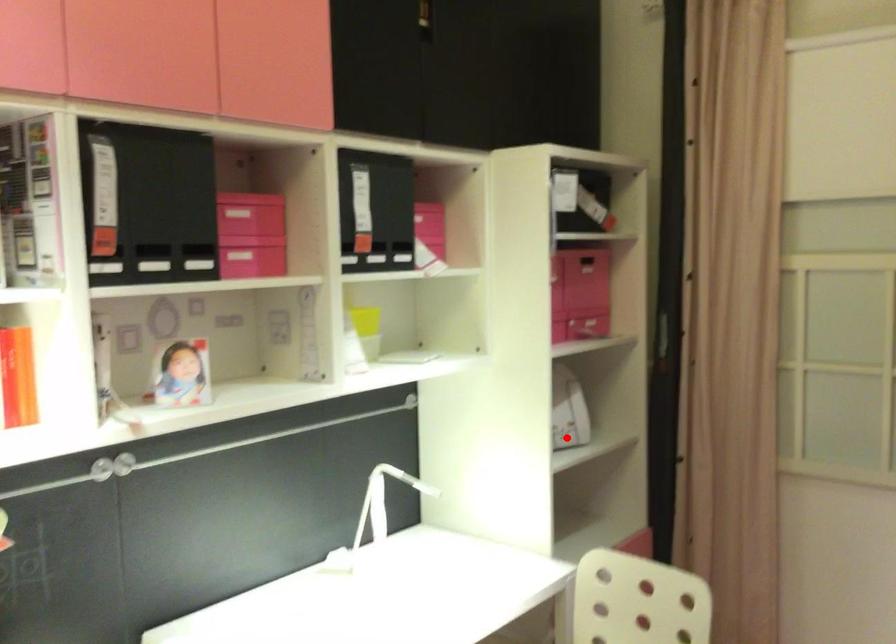
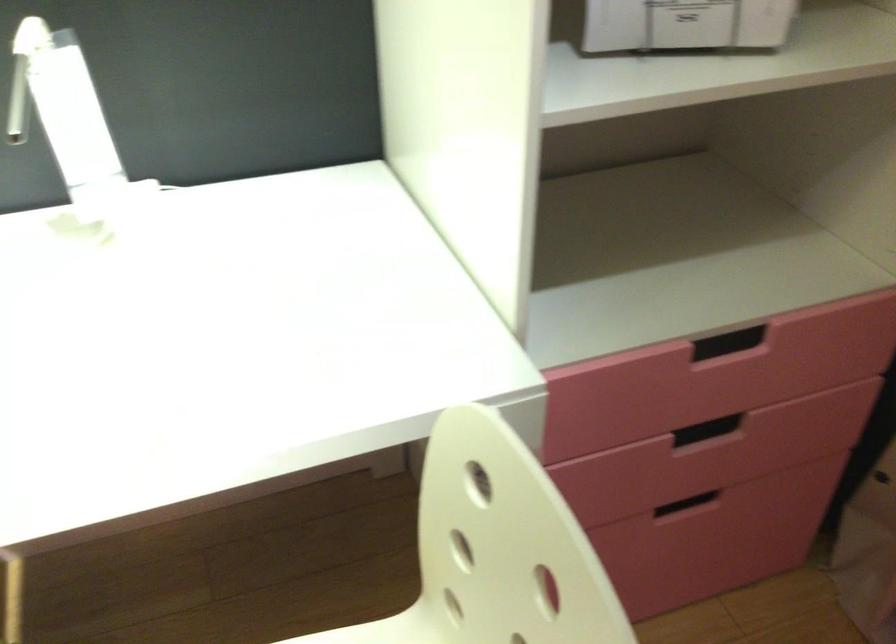
Question: I am providing you with two images of the same scene from different viewpoints. A red point is shown in image1. For the corresponding object point in image2, is it positioned nearer or farther from the camera?

Choices:
 (A) Nearer
 (B) Farther

Answer: (A)